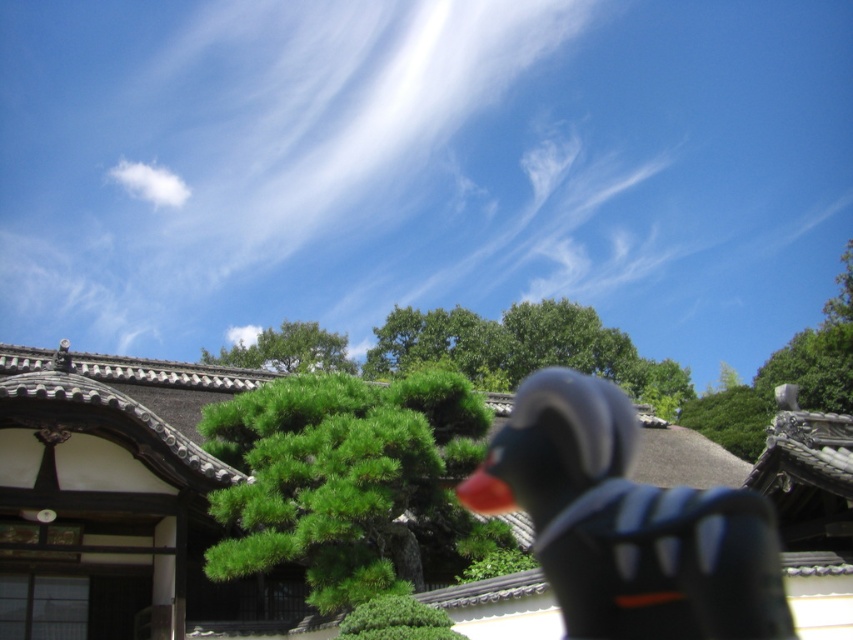
Between black matte duck at center and white fluffy cloud at upper left, which one appears on the left side from the viewer's perspective?

From the viewer's perspective, white fluffy cloud at upper left appears more on the left side.

Describe the element at coordinates (627, 524) in the screenshot. I see `black matte duck at center` at that location.

Locate an element on the screen. The width and height of the screenshot is (853, 640). black matte duck at center is located at coordinates point(627,524).

From the picture: Does green leafy tree at center have a greater width compared to white fluffy cloud at upper left?

Indeed, green leafy tree at center has a greater width compared to white fluffy cloud at upper left.

Can you confirm if green leafy tree at center is taller than white fluffy cloud at upper left?

In fact, green leafy tree at center may be shorter than white fluffy cloud at upper left.

Does point (318, 353) come behind point (144, 172)?

No, (318, 353) is in front of (144, 172).

At what (x,y) coordinates should I click in order to perform the action: click on green leafy tree at center. Please return your answer as a coordinate pair (x, y). Looking at the image, I should click on (288, 349).

How much distance is there between green matte tree at center and green leafy tree at center?

The distance of green matte tree at center from green leafy tree at center is 62.34 meters.

The height and width of the screenshot is (640, 853). Find the location of `green matte tree at center`. green matte tree at center is located at coordinates (346, 480).